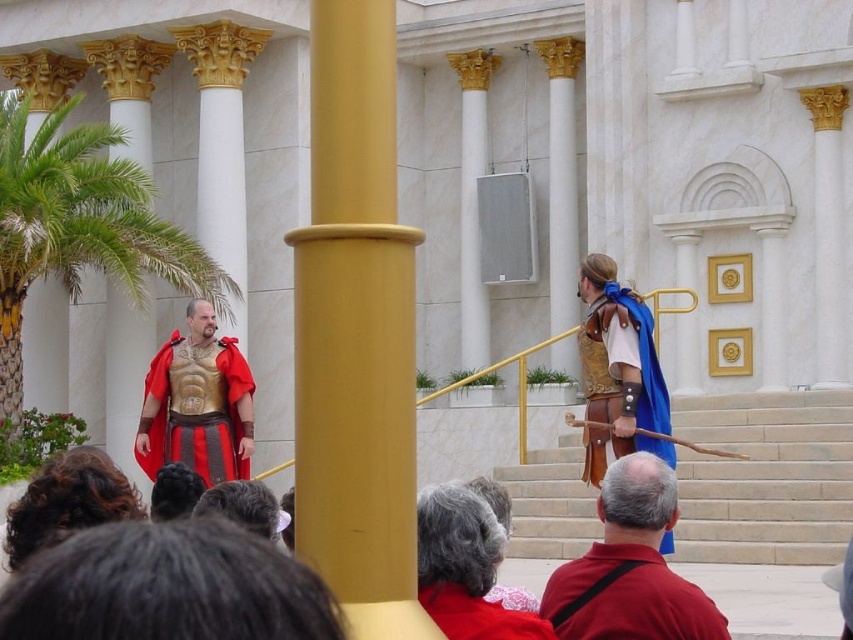
Which of these two, blue leather armor at right or velvet red cape at center, stands taller?

velvet red cape at center is taller.

Is point (662, 385) closer to camera compared to point (494, 618)?

No.

This screenshot has height=640, width=853. Find the location of `blue leather armor at right`. blue leather armor at right is located at coordinates (637, 355).

Does red leather belt at center appear over blue leather armor at right?

Incorrect, red leather belt at center is not positioned above blue leather armor at right.

Between red leather belt at center and blue leather armor at right, which one has less height?

With less height is blue leather armor at right.

Who is more forward, (573, 612) or (642, 392)?

Point (573, 612) is more forward.

Locate an element on the screen. This screenshot has width=853, height=640. red leather belt at center is located at coordinates (630, 566).

Between green leafy palm tree at left and gold metallic armor at center, which one is positioned higher?

green leafy palm tree at left is above.

Is green leafy palm tree at left above gold metallic armor at center?

Correct, green leafy palm tree at left is located above gold metallic armor at center.

I want to click on green leafy palm tree at left, so click(79, 225).

The width and height of the screenshot is (853, 640). Find the location of `green leafy palm tree at left`. green leafy palm tree at left is located at coordinates (79, 225).